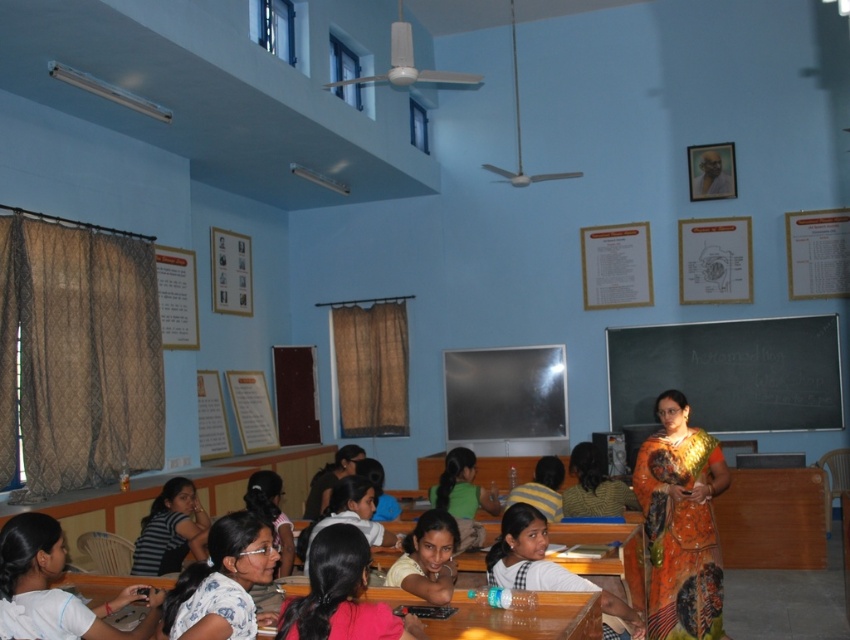
You are a student sitting at your desk in the classroom. You notice two points marked on the blackboard. The first point is at coordinates point (391, 570) and the second point is at point (445, 476). From your perspective, which point is closer to you?

Point (391, 570) is in front of point (445, 476), so it is closer to you.